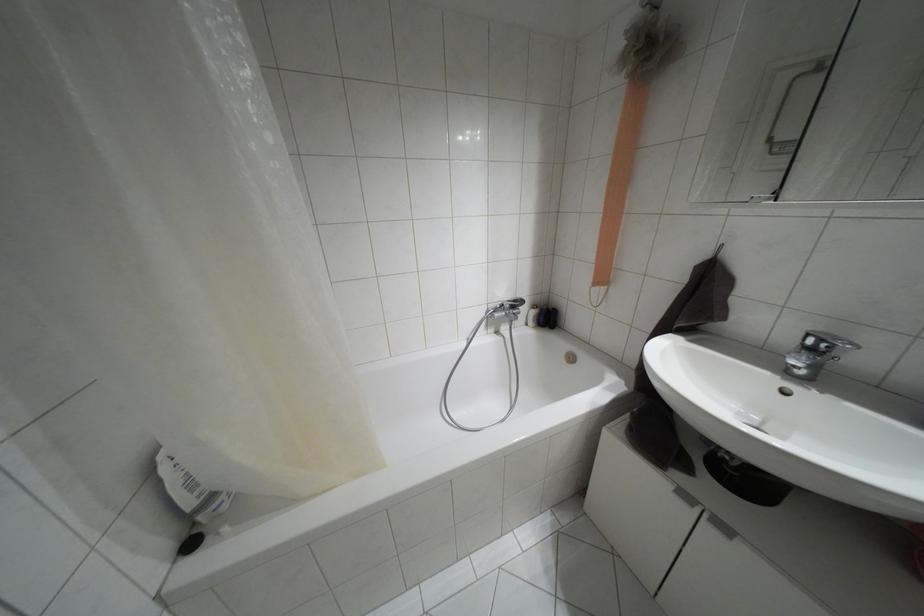
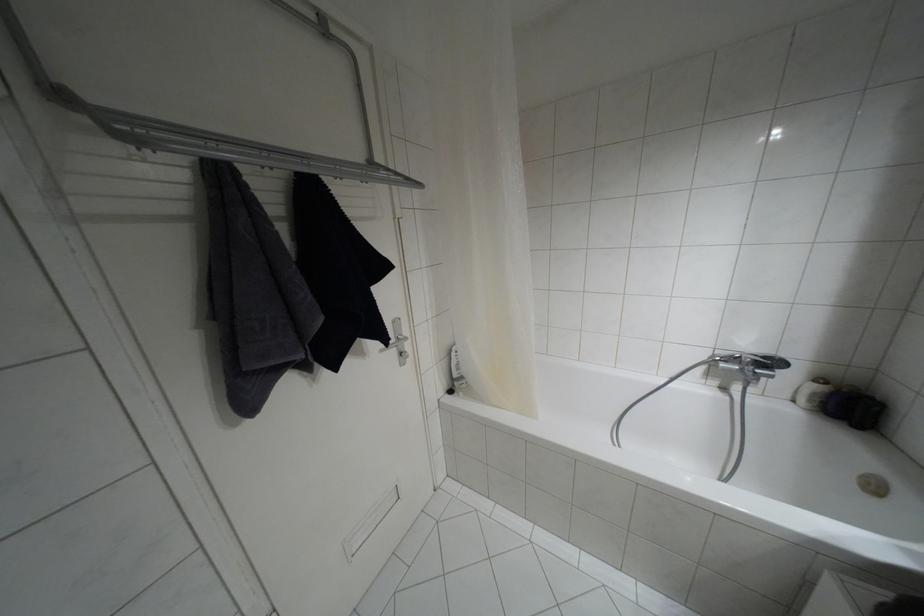
Question: I am providing you with two images of the same scene from different viewpoints. After the viewpoint changes to image2, which objects are now occluded?

Choices:
 (A) white bottle
 (B) faucet lever
 (C) silver door handle
 (D) none of these

Answer: (D)